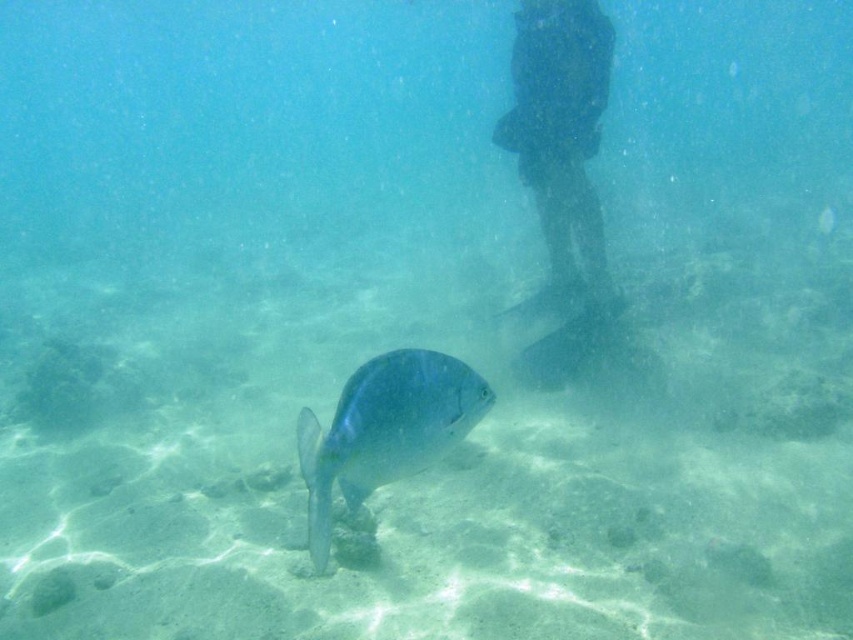
Question: Does dark blue rubber boots at upper center appear under shiny blue fish at center?

Choices:
 (A) yes
 (B) no

Answer: (B)

Question: Which point is closer to the camera taking this photo?

Choices:
 (A) pyautogui.click(x=401, y=413)
 (B) pyautogui.click(x=602, y=28)

Answer: (A)

Question: Which of the following is the farthest from the observer?

Choices:
 (A) (596, 262)
 (B) (483, 413)

Answer: (A)

Question: Is dark blue rubber boots at upper center closer to camera compared to shiny blue fish at center?

Choices:
 (A) no
 (B) yes

Answer: (A)

Question: Which point appears closest to the camera in this image?

Choices:
 (A) (311, 529)
 (B) (583, 300)

Answer: (A)

Question: Does dark blue rubber boots at upper center have a lesser width compared to shiny blue fish at center?

Choices:
 (A) yes
 (B) no

Answer: (B)